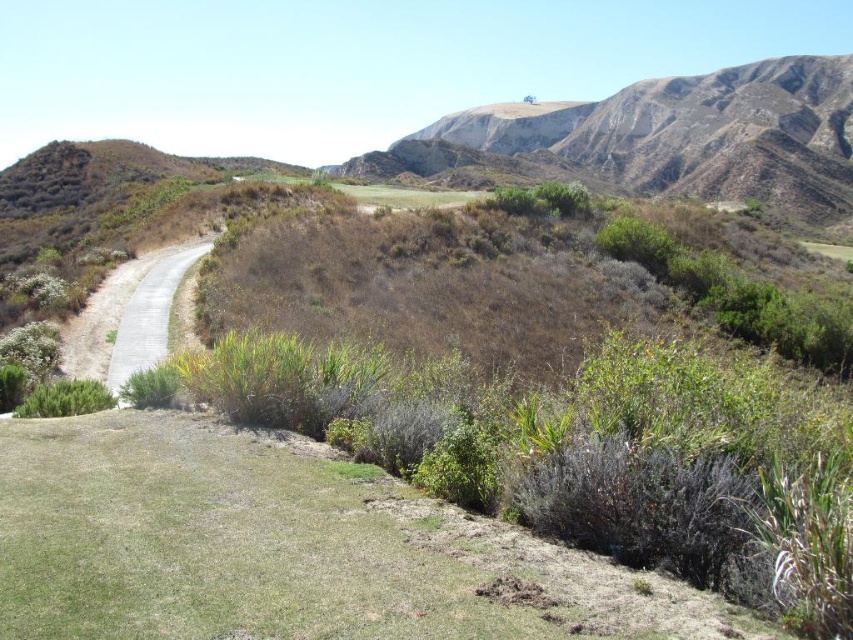
How distant is green grassy at lower left from rugged brown mountain at upper right?

green grassy at lower left is 357.74 meters away from rugged brown mountain at upper right.

Which is more to the right, green grassy at lower left or rugged brown mountain at upper right?

rugged brown mountain at upper right

Identify the location of green grassy at lower left. (283, 547).